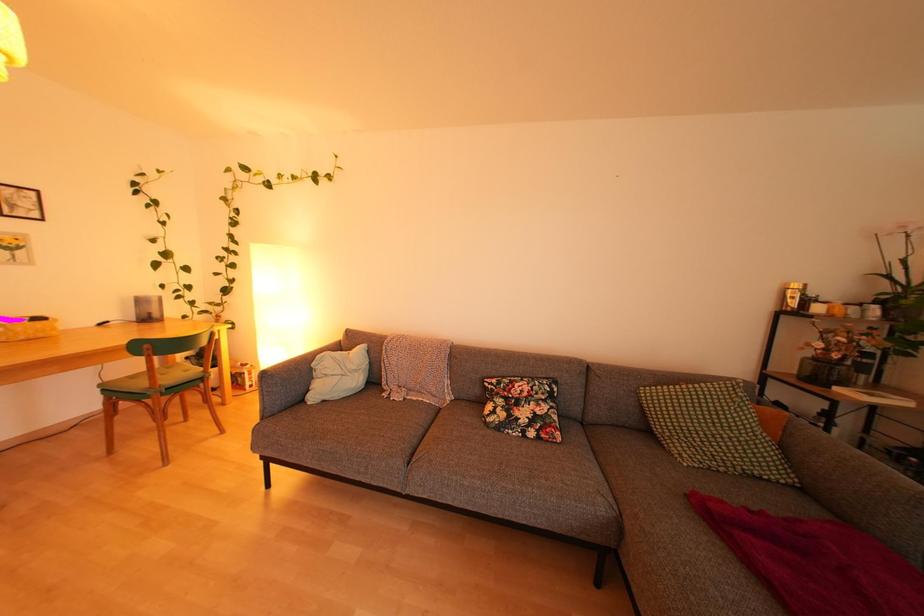
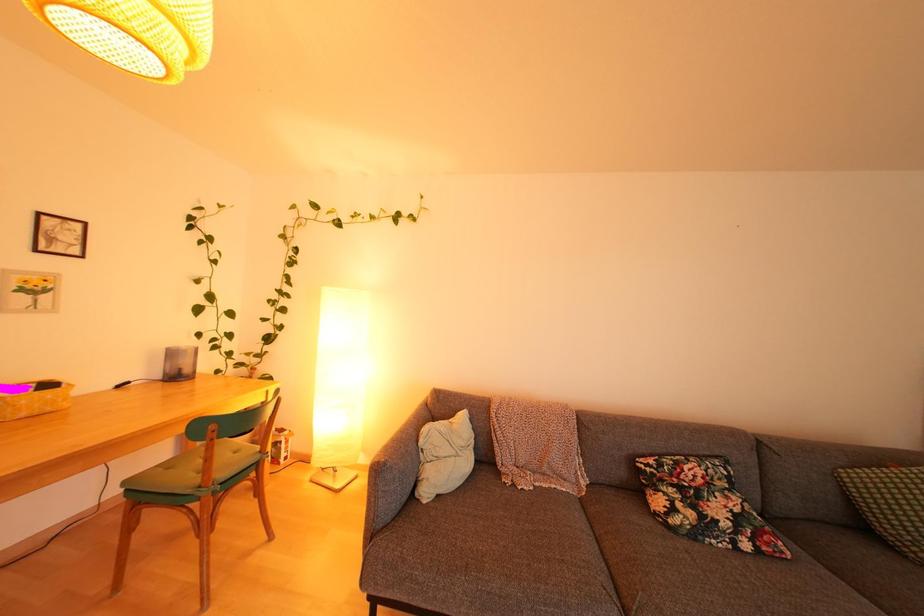
Question: The images are taken continuously from a first-person perspective. In which direction are you moving?

Choices:
 (A) Left
 (B) Right
 (C) Forward
 (D) Backward

Answer: (A)